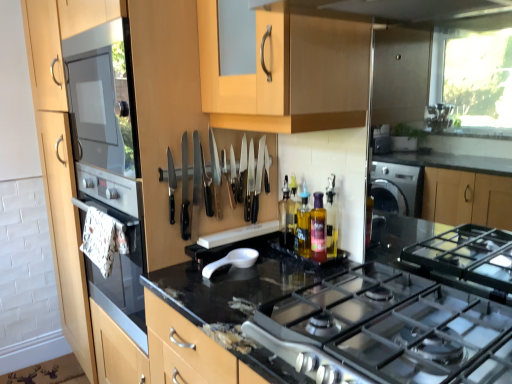
Question: Visually, is white matte spoon at center positioned to the left or to the right of translucent plastic bottle at center, which is the 3th bottle in front-to-back order?

Choices:
 (A) left
 (B) right

Answer: (A)

Question: Is point (211, 269) positioned closer to the camera than point (287, 241)?

Choices:
 (A) closer
 (B) farther

Answer: (A)

Question: Which is farther from the translucent purple bottle at center, which is counted as the 2th bottle, starting from the back?

Choices:
 (A) white matte spoon at center
 (B) translucent plastic bottle at center, the 3th bottle from the back
 (C) black granite countertop at center
 (D) black plastic knives at center
 (E) translucent plastic bottle at center, which is the 3th bottle in front-to-back order

Answer: (C)

Question: Which object is the farthest from the translucent plastic bottle at center, placed as the first bottle when sorted from front to back?

Choices:
 (A) black granite countertop at center
 (B) translucent purple bottle at center, which is counted as the 2th bottle, starting from the back
 (C) black plastic knives at center
 (D) translucent plastic bottle at center, which is the 3th bottle in front-to-back order
 (E) white matte spoon at center

Answer: (A)